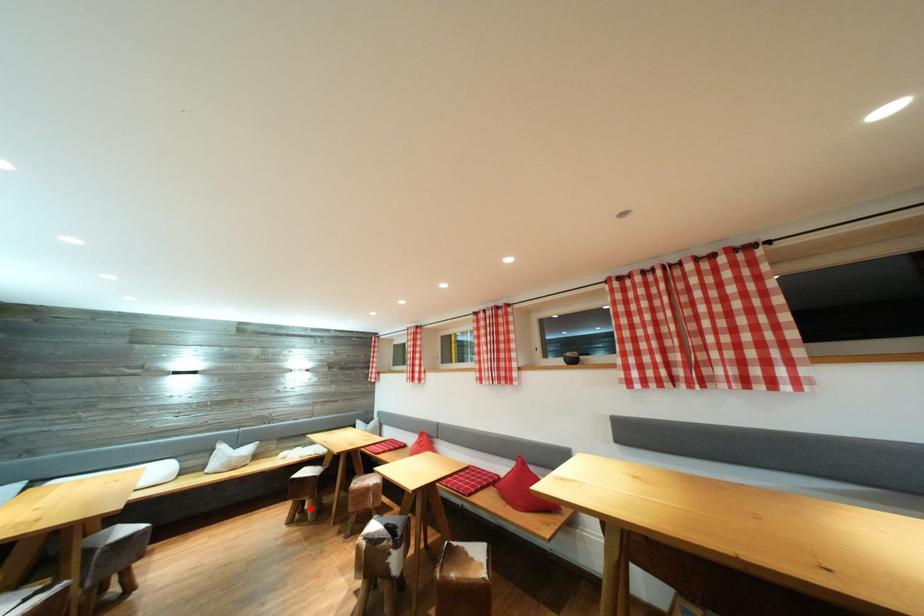
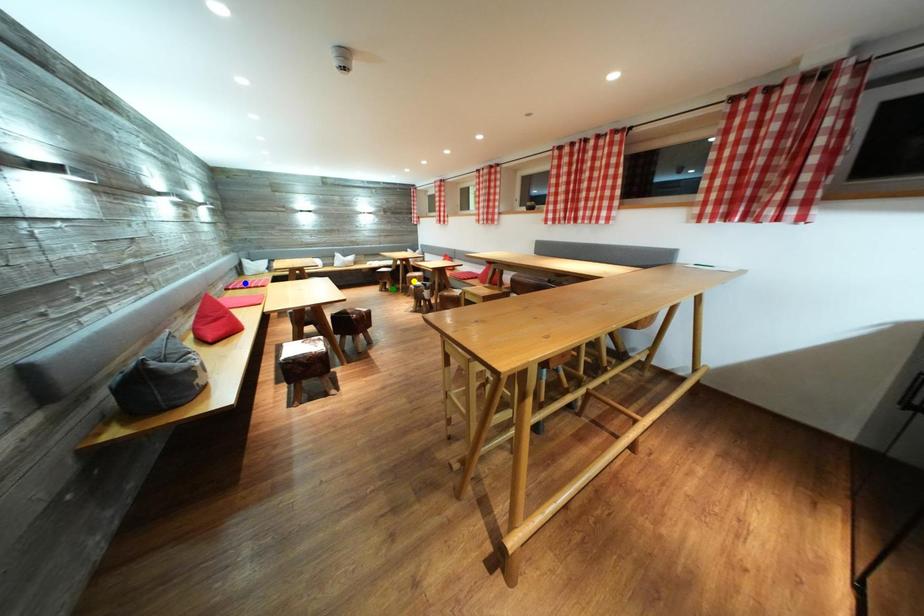
Question: I am providing you with two images of the same scene from different viewpoints. A red point is marked on the first image. You are given multiple points on the second image. Can you choose the point in image 2 that corresponds to the point in image 1?

Choices:
 (A) yellow point
 (B) green point
 (C) blue point

Answer: (B)